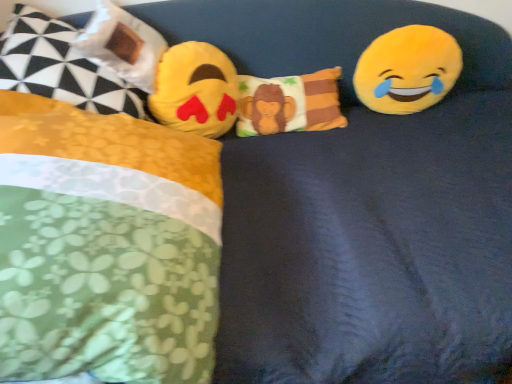
Question: Is yellow plush emoji at center, the 2th toy in the right-to-left sequence, bigger than fluffy cotton monkey pillow at center, the 4th pillow positioned from the left?

Choices:
 (A) yes
 (B) no

Answer: (A)

Question: From the image's perspective, is yellow plush emoji at center, positioned as the 1th toy in left-to-right order, beneath fluffy cotton monkey pillow at center, which is the first pillow from right to left?

Choices:
 (A) no
 (B) yes

Answer: (B)

Question: Is yellow plush emoji at center, positioned as the 1th toy in left-to-right order, to the left of fluffy cotton monkey pillow at center, which is the first pillow from right to left, from the viewer's perspective?

Choices:
 (A) no
 (B) yes

Answer: (B)

Question: From a real-world perspective, is yellow plush emoji at center, positioned as the 1th toy in left-to-right order, below fluffy cotton monkey pillow at center, which is the first pillow from right to left?

Choices:
 (A) no
 (B) yes

Answer: (A)

Question: From a real-world perspective, is yellow plush emoji at center, the 2th toy in the right-to-left sequence, located higher than fluffy cotton monkey pillow at center, which is the first pillow from right to left?

Choices:
 (A) no
 (B) yes

Answer: (B)

Question: Is yellow plush emoji at center, positioned as the 1th toy in left-to-right order, far away from fluffy cotton monkey pillow at center, the 4th pillow positioned from the left?

Choices:
 (A) yes
 (B) no

Answer: (B)

Question: Is yellow plush emoji at center, the 2th toy in the right-to-left sequence, looking in the opposite direction of matte plastic bag at upper left, the 2th pillow from the left?

Choices:
 (A) no
 (B) yes

Answer: (A)

Question: Does yellow plush emoji at center, the 2th toy in the right-to-left sequence, have a larger size compared to matte plastic bag at upper left, the third pillow when ordered from right to left?

Choices:
 (A) no
 (B) yes

Answer: (B)

Question: Is yellow plush emoji at center, the 2th toy in the right-to-left sequence, aimed at matte plastic bag at upper left, the third pillow when ordered from right to left?

Choices:
 (A) yes
 (B) no

Answer: (B)

Question: Does yellow plush emoji at center, the 2th toy in the right-to-left sequence, come in front of matte plastic bag at upper left, the 2th pillow from the left?

Choices:
 (A) yes
 (B) no

Answer: (B)

Question: Is yellow plush emoji at center, the 2th toy in the right-to-left sequence, at the right side of matte plastic bag at upper left, the third pillow when ordered from right to left?

Choices:
 (A) no
 (B) yes

Answer: (B)

Question: Does yellow plush emoji at center, the 2th toy in the right-to-left sequence, appear on the left side of matte plastic bag at upper left, the 2th pillow from the left?

Choices:
 (A) yes
 (B) no

Answer: (B)

Question: Can you confirm if fluffy yellow pillow at left, acting as the 2th pillow starting from the right, is smaller than fluffy cotton monkey pillow at center, the 4th pillow positioned from the left?

Choices:
 (A) no
 (B) yes

Answer: (A)